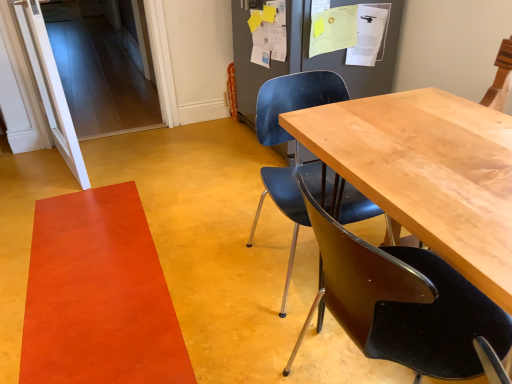
Consider the image. In order to face light brown wood table at center, should I rotate leftwards or rightwards?

It's best to rotate right around 19.276 degrees.

The width and height of the screenshot is (512, 384). What do you see at coordinates (426, 173) in the screenshot?
I see `light brown wood table at center` at bounding box center [426, 173].

Describe the element at coordinates (294, 100) in the screenshot. I see `matte black chair at center, which is counted as the 1th chair, starting from the back` at that location.

Find the location of a particular element. The width and height of the screenshot is (512, 384). light brown wood table at center is located at coordinates (426, 173).

Is matte black chair at center, which is counted as the second chair, starting from the front, located within light brown wood table at center?

No, matte black chair at center, which is counted as the second chair, starting from the front, is not inside light brown wood table at center.

Is light brown wood table at center not near matte black chair at center, which is counted as the 1th chair, starting from the back?

No, there isn't a large distance between light brown wood table at center and matte black chair at center, which is counted as the 1th chair, starting from the back.

Is light brown wood table at center facing away from matte black chair at center, which is counted as the second chair, starting from the front?

No, matte black chair at center, which is counted as the second chair, starting from the front, is not at the back of light brown wood table at center.

From a real-world perspective, relative to matte black chair at center, which is counted as the 1th chair, starting from the back, is light brown wood table at center vertically above or below?

light brown wood table at center is situated higher than matte black chair at center, which is counted as the 1th chair, starting from the back, in the real world.

From a real-world perspective, is matte black chair at center, which is counted as the 1th chair, starting from the back, located higher than orange matte rug at lower left?

Yes, from a real-world perspective, matte black chair at center, which is counted as the 1th chair, starting from the back, is over orange matte rug at lower left

How different are the orientations of matte black chair at center, which is counted as the 1th chair, starting from the back, and orange matte rug at lower left in degrees?

0.107 degrees.

Who is smaller, matte black chair at center, which is counted as the 1th chair, starting from the back, or orange matte rug at lower left?

orange matte rug at lower left.

Between point (481, 306) and point (412, 107), which one is positioned behind?

Positioned behind is point (412, 107).

From the image's perspective, which one is positioned lower, matte black chair at center, which is the 1th chair from front to back, or light brown wood table at center?

From the image's view, matte black chair at center, which is the 1th chair from front to back, is below.

Is matte black chair at center, which appears as the 2th chair when viewed from the back, inside or outside of light brown wood table at center?

The correct answer is: inside.

Considering the sizes of objects matte black chair at center, which is the 1th chair from front to back, and light brown wood table at center in the image provided, who is wider, matte black chair at center, which is the 1th chair from front to back, or light brown wood table at center?

Wider between the two is light brown wood table at center.

Is light brown wood table at center bigger than orange matte rug at lower left?

Correct, light brown wood table at center is larger in size than orange matte rug at lower left.

Is orange matte rug at lower left surrounded by light brown wood table at center?

No, orange matte rug at lower left is not surrounded by light brown wood table at center.

Considering their positions, is light brown wood table at center located in front of or behind orange matte rug at lower left?

Clearly, light brown wood table at center is in front of orange matte rug at lower left.

Which object is thinner, light brown wood table at center or orange matte rug at lower left?

With smaller width is light brown wood table at center.

Does point (499, 286) come behind point (464, 295)?

No.

Is light brown wood table at center completely or partially outside of matte black chair at center, which appears as the 2th chair when viewed from the back?

That's incorrect, light brown wood table at center is not completely outside matte black chair at center, which appears as the 2th chair when viewed from the back.

From the image's perspective, is light brown wood table at center over matte black chair at center, which is the 1th chair from front to back?

Yes, from the image's perspective, light brown wood table at center is above matte black chair at center, which is the 1th chair from front to back.

Does light brown wood table at center lie behind matte black chair at center, which appears as the 2th chair when viewed from the back?

Yes, light brown wood table at center is further from the viewer.

From a real-world perspective, which object stands above the other?

light brown wood table at center, from a real-world perspective.

Which of these two, orange matte rug at lower left or light brown wood table at center, stands taller?

Standing taller between the two is light brown wood table at center.

Which is in front, orange matte rug at lower left or light brown wood table at center?

light brown wood table at center.

Between point (77, 238) and point (378, 127), which one is positioned in front?

The point (378, 127) is in front.

From a real-world perspective, which object rests below the other?

From a 3D spatial view, orange matte rug at lower left is below.

Which of these two, orange matte rug at lower left or matte black chair at center, which is counted as the 1th chair, starting from the back, stands shorter?

orange matte rug at lower left.

Between orange matte rug at lower left and matte black chair at center, which is counted as the second chair, starting from the front, which one has larger width?

With larger width is orange matte rug at lower left.

Can you confirm if orange matte rug at lower left is smaller than matte black chair at center, which is counted as the 1th chair, starting from the back?

Yes.

Find the location of a particular element. The image size is (512, 384). table on the right of matte black chair at center, which is counted as the 1th chair, starting from the back is located at coordinates (426, 173).

Image resolution: width=512 pixels, height=384 pixels. Identify the location of the 1st chair directly above the orange matte rug at lower left (from a real-world perspective). (294, 100).

When comparing their distances from orange matte rug at lower left, does light brown wood table at center or matte black chair at center, which appears as the 2th chair when viewed from the back, seem further?

light brown wood table at center lies further to orange matte rug at lower left than the other object.

Estimate the real-world distances between objects in this image. Which object is further from light brown wood table at center, orange matte rug at lower left or matte black chair at center, which is the 1th chair from front to back?

Based on the image, orange matte rug at lower left appears to be further to light brown wood table at center.

Considering their positions, is orange matte rug at lower left positioned closer to matte black chair at center, which is counted as the 1th chair, starting from the back, than light brown wood table at center?

The object closer to matte black chair at center, which is counted as the 1th chair, starting from the back, is light brown wood table at center.

Estimate the real-world distances between objects in this image. Which object is further from matte black chair at center, which is counted as the 1th chair, starting from the back, matte black chair at center, which is the 1th chair from front to back, or light brown wood table at center?

matte black chair at center, which is the 1th chair from front to back, is positioned further to the anchor matte black chair at center, which is counted as the 1th chair, starting from the back.

Which object lies nearer to the anchor point orange matte rug at lower left, matte black chair at center, which appears as the 2th chair when viewed from the back, or light brown wood table at center?

Based on the image, matte black chair at center, which appears as the 2th chair when viewed from the back, appears to be nearer to orange matte rug at lower left.

From the image, which object appears to be nearer to orange matte rug at lower left, light brown wood table at center or matte black chair at center, which is counted as the 1th chair, starting from the back?

matte black chair at center, which is counted as the 1th chair, starting from the back, lies closer to orange matte rug at lower left than the other object.

In the scene shown: Estimate the real-world distances between objects in this image. Which object is further from matte black chair at center, which appears as the 2th chair when viewed from the back, matte black chair at center, which is counted as the 1th chair, starting from the back, or orange matte rug at lower left?

orange matte rug at lower left.

Considering their positions, is matte black chair at center, which appears as the 2th chair when viewed from the back, positioned closer to orange matte rug at lower left than matte black chair at center, which is counted as the 1th chair, starting from the back?

matte black chair at center, which is counted as the 1th chair, starting from the back, lies closer to orange matte rug at lower left than the other object.

Where is `table between matte black chair at center, which is the 1th chair from front to back, and matte black chair at center, which is counted as the 1th chair, starting from the back, from front to back`? The height and width of the screenshot is (384, 512). table between matte black chair at center, which is the 1th chair from front to back, and matte black chair at center, which is counted as the 1th chair, starting from the back, from front to back is located at coordinates (426, 173).

Identify the location of chair between orange matte rug at lower left and matte black chair at center, which appears as the 2th chair when viewed from the back. (294, 100).